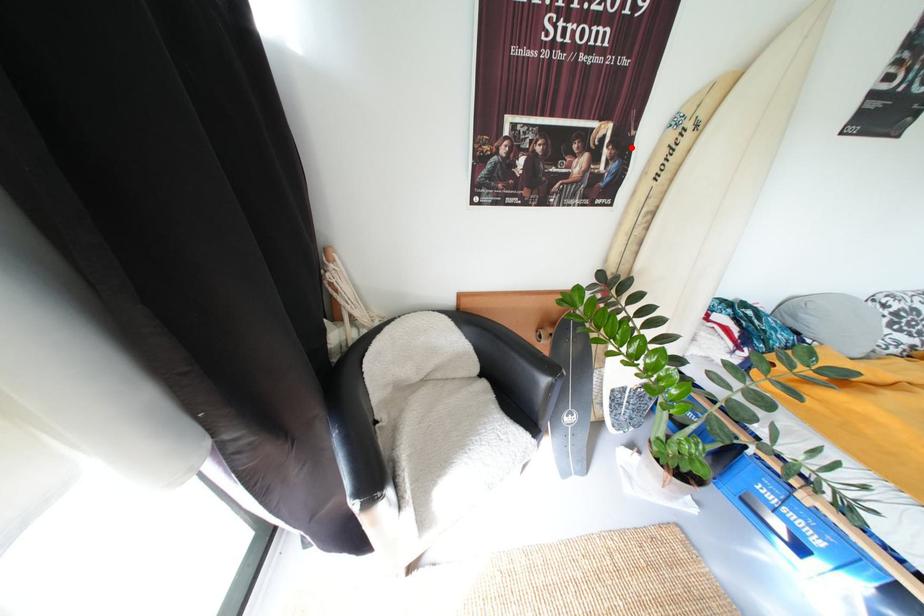
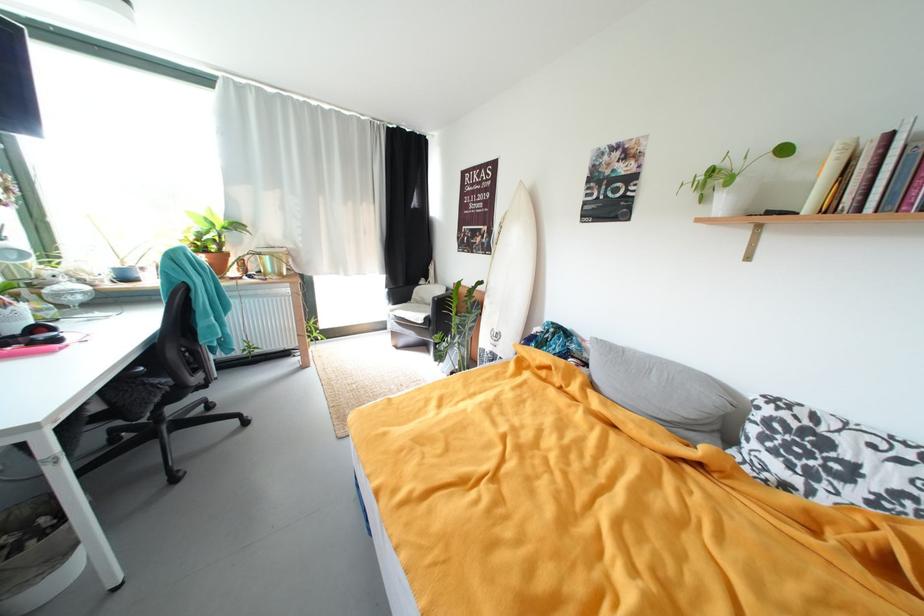
In the second image, find the point that corresponds to the highlighted location in the first image.

(497, 235)